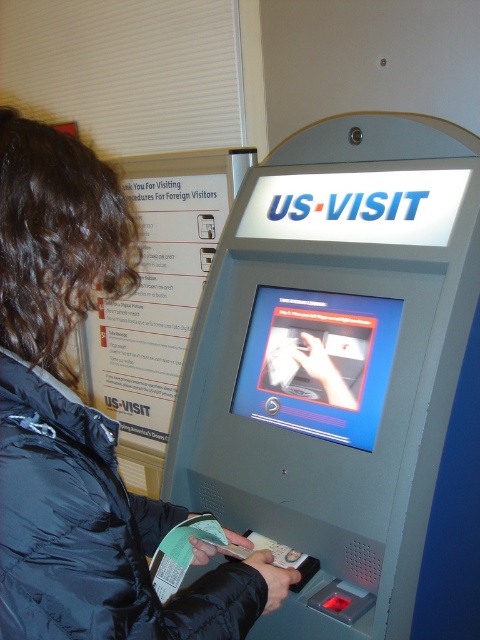
Is black matte jacket at center shorter than black puffy jacket at center?

No, black matte jacket at center is not shorter than black puffy jacket at center.

Is the position of black matte jacket at center more distant than that of black puffy jacket at center?

No, black matte jacket at center is in front of black puffy jacket at center.

Is point (107, 164) behind point (72, 432)?

Yes, it is.

Image resolution: width=480 pixels, height=640 pixels. I want to click on black matte jacket at center, so click(x=82, y=422).

Who is more forward, (x=316, y=326) or (x=254, y=596)?

Point (x=254, y=596)

Looking at this image, does gray metallic kiosk at center have a smaller size compared to black puffy jacket at center?

No, gray metallic kiosk at center is not smaller than black puffy jacket at center.

Is point (261, 328) closer to camera compared to point (80, 593)?

No.

Where is `gray metallic kiosk at center`? The height and width of the screenshot is (640, 480). gray metallic kiosk at center is located at coordinates (346, 376).

Who is positioned more to the right, gray metallic kiosk at center or black matte jacket at center?

gray metallic kiosk at center

Is gray metallic kiosk at center closer to camera compared to black matte jacket at center?

No.

In order to click on gray metallic kiosk at center in this screenshot , I will do `click(346, 376)`.